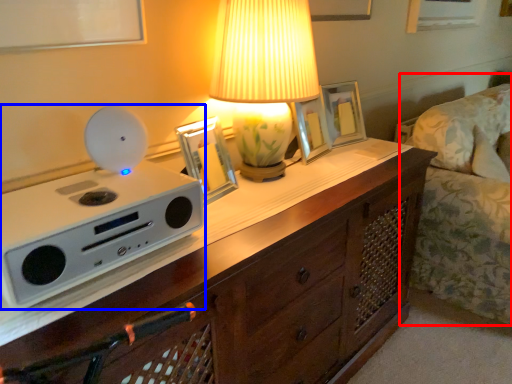
Question: Which object appears farthest to the camera in this image, couch (highlighted by a red box) or appliance (highlighted by a blue box)?

Choices:
 (A) couch
 (B) appliance

Answer: (A)